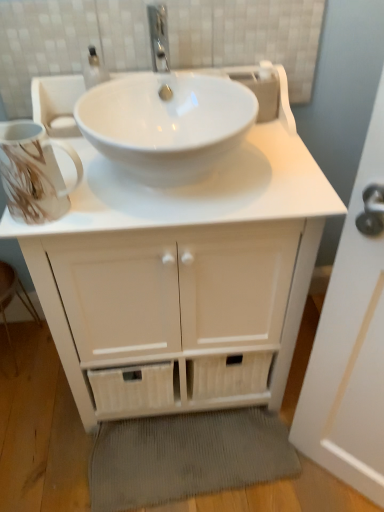
Question: From a real-world perspective, is gray corduroy bath mat at lower center on wooden step stool at lower left?

Choices:
 (A) yes
 (B) no

Answer: (B)

Question: Can you confirm if gray corduroy bath mat at lower center is smaller than wooden step stool at lower left?

Choices:
 (A) yes
 (B) no

Answer: (A)

Question: Does gray corduroy bath mat at lower center appear on the left side of wooden step stool at lower left?

Choices:
 (A) no
 (B) yes

Answer: (A)

Question: Does gray corduroy bath mat at lower center have a lesser width compared to wooden step stool at lower left?

Choices:
 (A) no
 (B) yes

Answer: (A)

Question: Is gray corduroy bath mat at lower center bigger than wooden step stool at lower left?

Choices:
 (A) no
 (B) yes

Answer: (A)

Question: Relative to wooden step stool at lower left, is white matte cabinet at center in front or behind?

Choices:
 (A) front
 (B) behind

Answer: (A)

Question: Is point (210, 291) positioned closer to the camera than point (26, 295)?

Choices:
 (A) farther
 (B) closer

Answer: (B)

Question: In terms of size, does white matte cabinet at center appear bigger or smaller than wooden step stool at lower left?

Choices:
 (A) big
 (B) small

Answer: (A)

Question: From a real-world perspective, is white matte cabinet at center positioned above or below wooden step stool at lower left?

Choices:
 (A) above
 (B) below

Answer: (A)

Question: From their relative heights in the image, would you say wooden step stool at lower left is taller or shorter than white matte cabinet at center?

Choices:
 (A) tall
 (B) short

Answer: (B)

Question: Considering the positions of point (4, 269) and point (107, 365), is point (4, 269) closer or farther from the camera than point (107, 365)?

Choices:
 (A) farther
 (B) closer

Answer: (A)

Question: In the image, is wooden step stool at lower left on the left side or the right side of white matte cabinet at center?

Choices:
 (A) left
 (B) right

Answer: (A)

Question: From a real-world perspective, is wooden step stool at lower left above or below white matte cabinet at center?

Choices:
 (A) above
 (B) below

Answer: (B)

Question: Considering the positions of gray corduroy bath mat at lower center and white matte cabinet at center in the image, is gray corduroy bath mat at lower center wider or thinner than white matte cabinet at center?

Choices:
 (A) wide
 (B) thin

Answer: (B)

Question: In terms of height, does gray corduroy bath mat at lower center look taller or shorter compared to white matte cabinet at center?

Choices:
 (A) short
 (B) tall

Answer: (A)